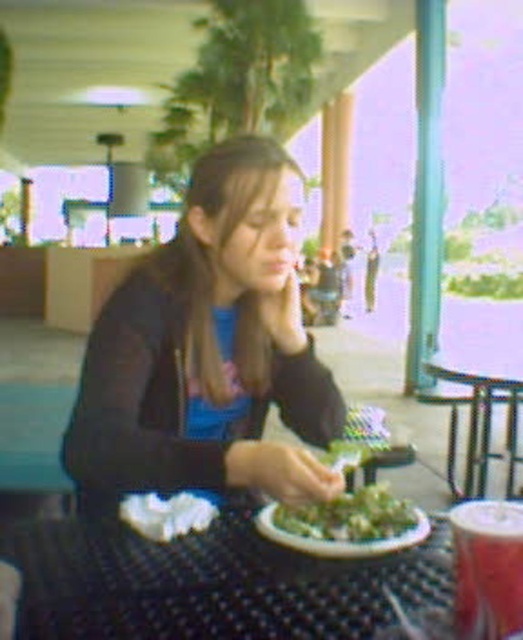
Locate an element on the screen. matte black sweater at center is located at coordinates (206, 349).

Is matte black sweater at center wider than white glossy plate at center?

Yes, matte black sweater at center is wider than white glossy plate at center.

Which is in front, point (138, 465) or point (369, 541)?

Point (369, 541) is more forward.

Locate an element on the screen. The height and width of the screenshot is (640, 523). matte black sweater at center is located at coordinates (206, 349).

Is translucent plastic cup at lower right bigger than white fluffy clouds at center?

Yes.

Is translucent plastic cup at lower right thinner than white fluffy clouds at center?

Yes, translucent plastic cup at lower right is thinner than white fluffy clouds at center.

In order to click on translucent plastic cup at lower right in this screenshot , I will do `click(487, 568)`.

Who is shorter, black textured table at center or white fluffy clouds at center?

white fluffy clouds at center is shorter.

Can you confirm if black textured table at center is smaller than white fluffy clouds at center?

No, black textured table at center is not smaller than white fluffy clouds at center.

The height and width of the screenshot is (640, 523). Find the location of `black textured table at center`. black textured table at center is located at coordinates (209, 584).